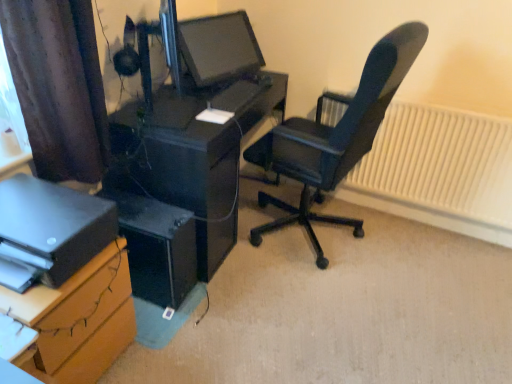
Question: Is white textured radiator at right not close to matte black printer at lower left?

Choices:
 (A) yes
 (B) no

Answer: (A)

Question: From the image's perspective, is white textured radiator at right on matte black printer at lower left?

Choices:
 (A) yes
 (B) no

Answer: (A)

Question: Can you confirm if white textured radiator at right is shorter than matte black printer at lower left?

Choices:
 (A) no
 (B) yes

Answer: (A)

Question: Does white textured radiator at right appear on the left side of matte black printer at lower left?

Choices:
 (A) no
 (B) yes

Answer: (A)

Question: Considering the relative positions of white textured radiator at right and matte black printer at lower left in the image provided, is white textured radiator at right to the right of matte black printer at lower left from the viewer's perspective?

Choices:
 (A) yes
 (B) no

Answer: (A)

Question: From a real-world perspective, is black leather office chair at right physically located above or below black plastic computer tower at lower left?

Choices:
 (A) below
 (B) above

Answer: (B)

Question: Is point (395, 44) positioned closer to the camera than point (133, 248)?

Choices:
 (A) closer
 (B) farther

Answer: (A)

Question: Considering the positions of black leather office chair at right and black plastic computer tower at lower left in the image, is black leather office chair at right bigger or smaller than black plastic computer tower at lower left?

Choices:
 (A) big
 (B) small

Answer: (A)

Question: In terms of width, does black leather office chair at right look wider or thinner when compared to black plastic computer tower at lower left?

Choices:
 (A) thin
 (B) wide

Answer: (B)

Question: Is point coord(399,77) closer or farther from the camera than point coord(50,109)?

Choices:
 (A) closer
 (B) farther

Answer: (B)

Question: Is black leather office chair at right taller or shorter than brown fabric curtain at upper left?

Choices:
 (A) tall
 (B) short

Answer: (A)

Question: In terms of size, does black leather office chair at right appear bigger or smaller than brown fabric curtain at upper left?

Choices:
 (A) small
 (B) big

Answer: (B)

Question: Considering the positions of black leather office chair at right and brown fabric curtain at upper left in the image, is black leather office chair at right wider or thinner than brown fabric curtain at upper left?

Choices:
 (A) thin
 (B) wide

Answer: (B)

Question: Which is correct: black plastic computer tower at lower left is inside brown cardboard at lower left, which appears as the first desk when viewed from the front, or outside of it?

Choices:
 (A) inside
 (B) outside

Answer: (B)

Question: Based on their sizes in the image, would you say black plastic computer tower at lower left is bigger or smaller than brown cardboard at lower left, which appears as the first desk when viewed from the front?

Choices:
 (A) small
 (B) big

Answer: (A)